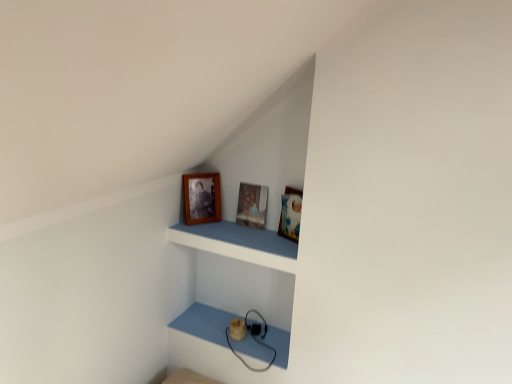
Locate an element on the screen. The height and width of the screenshot is (384, 512). vacant space in between wooden photo frame at upper center, placed as the 1th picture frame when sorted from left to right, and wooden picture frame at center, positioned as the 2th picture frame in left-to-right order is located at coordinates tap(220, 229).